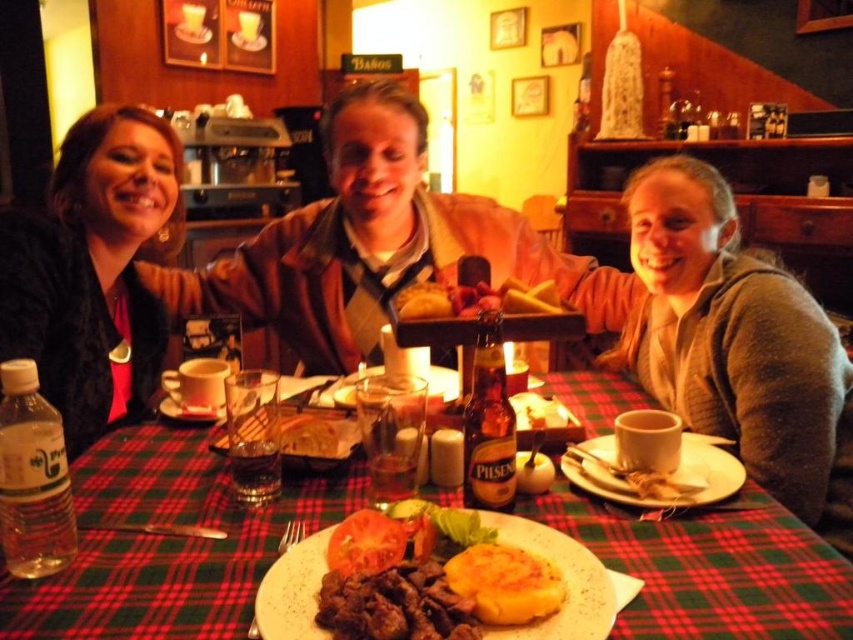
You are a customer sitting at the table with the red and green plaid tablecloth. You want to grab the item closest to you. Which point should you reach towards, point at coordinate (73,196) or point at coordinate (669,508)?

You should reach towards point at coordinate (73,196) because it is closer to you than point at coordinate (669,508).

You are a customer sitting at the table with the red and green plaid tablecloth. You want to reach for the item located at point (274, 262) and the item at point (697, 461). Which item will you need to reach further back to grab?

The item at point (274, 262) will require reaching further back because according to the description, point (274, 262) is behind point (697, 461).

You are a server in the restaurant and need to place a new order of a large pizza on the table. The pizza is too big to fit between the matte black jacket at left and the white ceramic plate at center. Which object should you move to make space?

Since the matte black jacket at left is larger in size than the white ceramic plate at center, you should move the matte black jacket at left to make space for the large pizza.